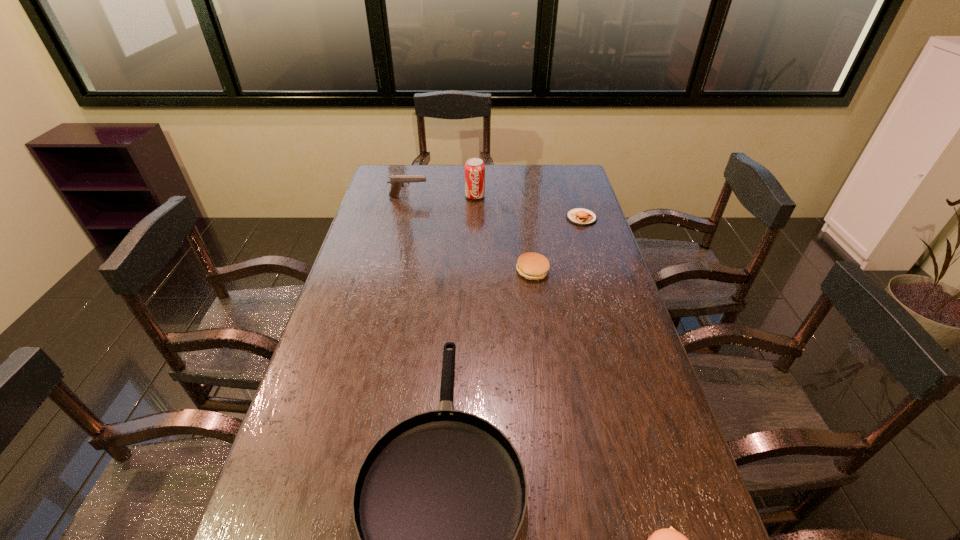
In order to click on the tallest object in this screenshot , I will do `click(474, 168)`.

You are a GUI agent. You are given a task and a screenshot of the screen. Output one action in this format:
    pyautogui.click(x=<x>, y=<y>)
    Task: Click on the pistol
    The height and width of the screenshot is (540, 960).
    Given the screenshot: What is the action you would take?
    pyautogui.click(x=397, y=181)

You are a GUI agent. You are given a task and a screenshot of the screen. Output one action in this format:
    pyautogui.click(x=<x>, y=<y>)
    Task: Click on the farthest patty
    The height and width of the screenshot is (540, 960).
    Given the screenshot: What is the action you would take?
    pyautogui.click(x=579, y=216)

The image size is (960, 540). I want to click on the fourth object from left to right, so click(533, 266).

What are the coordinates of `the leftmost patty` in the screenshot? It's located at (533, 266).

Locate an element on the screen. Image resolution: width=960 pixels, height=540 pixels. vacant space located on the logo side of the soda can is located at coordinates (474, 224).

This screenshot has width=960, height=540. Find the location of `free space located 0.130m at the barrel of the fifth shortest object`. free space located 0.130m at the barrel of the fifth shortest object is located at coordinates (459, 197).

Locate an element on the screen. The image size is (960, 540). free spot located 0.220m on the front of the third farthest object is located at coordinates (595, 264).

Identify the location of blank space located on the left of the third nearest object. (477, 271).

Identify the location of object present at the far edge. (474, 168).